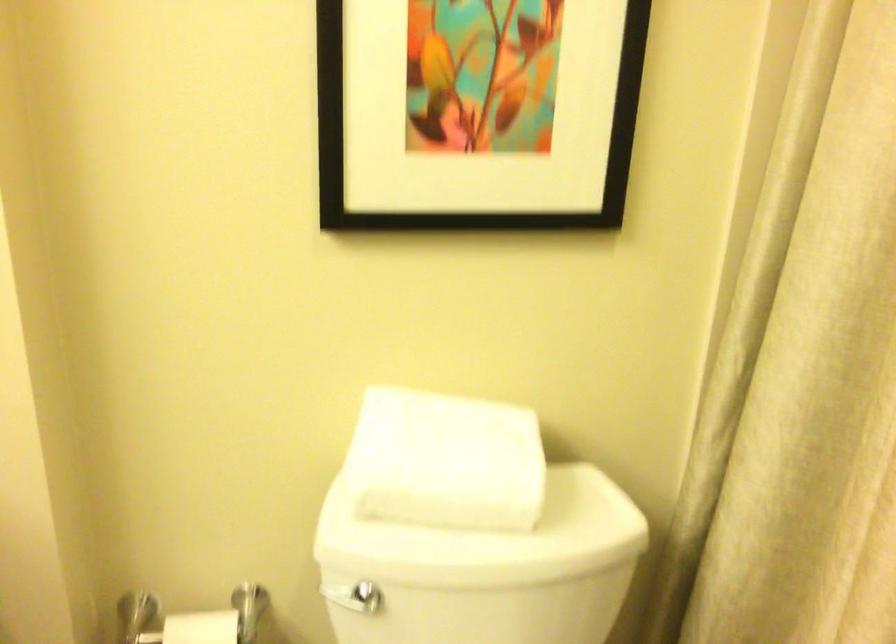
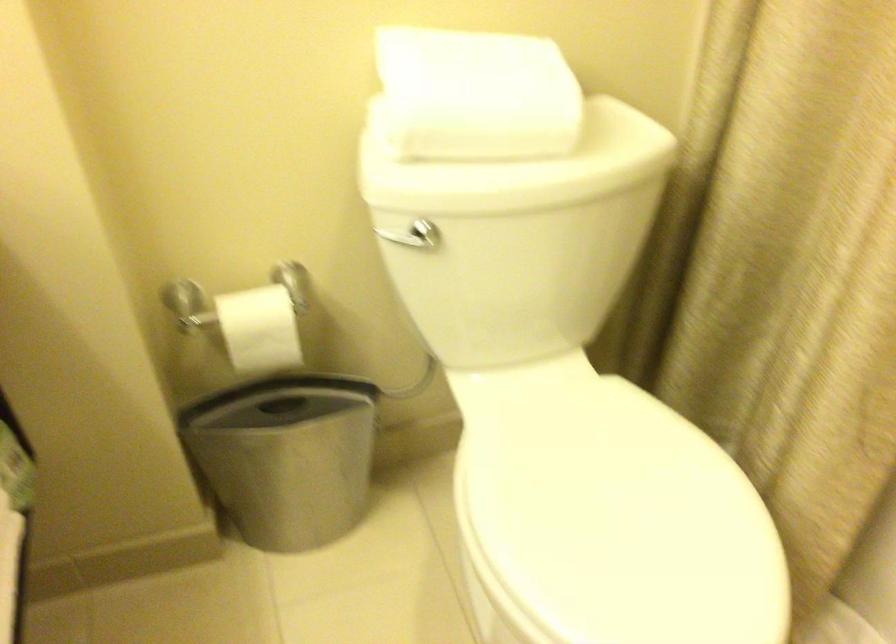
Find the pixel in the second image that matches pixel 477 542 in the first image.

(519, 167)